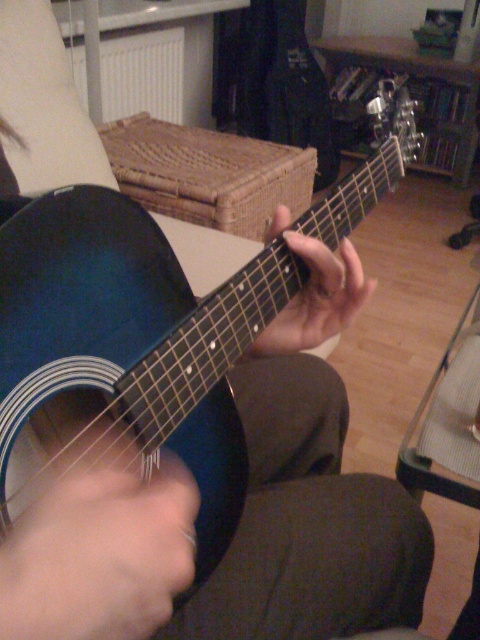
Question: Can you confirm if shiny blue acoustic guitar at center is smaller than matte black guitar at lower left?

Choices:
 (A) yes
 (B) no

Answer: (B)

Question: Which object is the farthest from the matte black guitar at center?

Choices:
 (A) shiny blue acoustic guitar at center
 (B) matte black guitar at lower left

Answer: (B)

Question: Among these objects, which one is farthest from the camera?

Choices:
 (A) white matte radiator at upper left
 (B) shiny blue acoustic guitar at center
 (C) matte black guitar at center

Answer: (A)

Question: Can you confirm if matte black guitar at lower left is thinner than white matte radiator at upper left?

Choices:
 (A) yes
 (B) no

Answer: (A)

Question: Which point appears farthest from the camera in this image?

Choices:
 (A) (212, 292)
 (B) (120, 522)
 (C) (310, 289)

Answer: (A)

Question: Is shiny blue acoustic guitar at center bigger than white matte radiator at upper left?

Choices:
 (A) no
 (B) yes

Answer: (B)